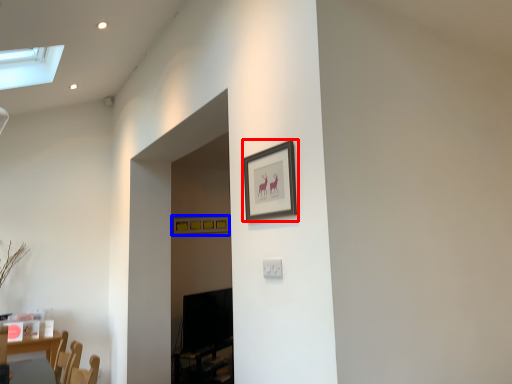
Question: Which point is closer to the camera, picture frame (highlighted by a red box) or picture frame (highlighted by a blue box)?

Choices:
 (A) picture frame
 (B) picture frame

Answer: (A)